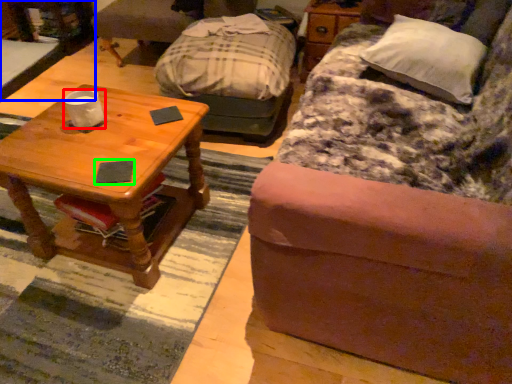
Question: Based on their relative distances, which object is farther from coffee cup (highlighted by a red box)? Choose from desk (highlighted by a blue box) and pad (highlighted by a green box).

Choices:
 (A) desk
 (B) pad

Answer: (A)